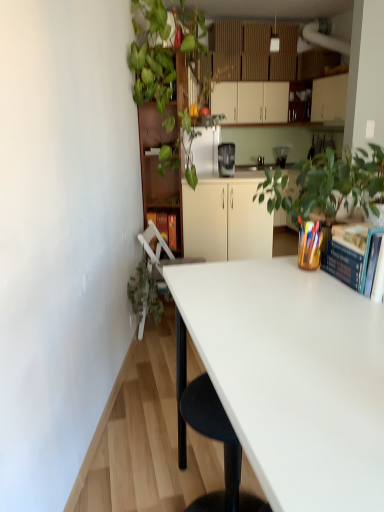
Question: Is matte black coffee maker at center looking in the opposite direction of satin black coffee maker at center?

Choices:
 (A) no
 (B) yes

Answer: (A)

Question: From the image's perspective, is matte black coffee maker at center located above satin black coffee maker at center?

Choices:
 (A) yes
 (B) no

Answer: (A)

Question: Would you say matte black coffee maker at center contains satin black coffee maker at center?

Choices:
 (A) yes
 (B) no

Answer: (B)

Question: From a real-world perspective, is matte black coffee maker at center positioned under satin black coffee maker at center based on gravity?

Choices:
 (A) no
 (B) yes

Answer: (B)

Question: Is matte black coffee maker at center outside satin black coffee maker at center?

Choices:
 (A) yes
 (B) no

Answer: (A)

Question: Considering their positions, is matte black coffee maker at center located in front of or behind blue hardcover book at upper right?

Choices:
 (A) front
 (B) behind

Answer: (B)

Question: From a real-world perspective, is matte black coffee maker at center above or below blue hardcover book at upper right?

Choices:
 (A) above
 (B) below

Answer: (A)

Question: Looking at their shapes, would you say matte black coffee maker at center is wider or thinner than blue hardcover book at upper right?

Choices:
 (A) thin
 (B) wide

Answer: (B)

Question: Would you say matte black coffee maker at center is to the left or to the right of blue hardcover book at upper right in the picture?

Choices:
 (A) left
 (B) right

Answer: (B)

Question: Does point (278, 146) appear closer or farther from the camera than point (264, 398)?

Choices:
 (A) closer
 (B) farther

Answer: (B)

Question: Is matte black coffee maker at center taller or shorter than white glossy desk at center?

Choices:
 (A) tall
 (B) short

Answer: (B)

Question: From a real-world perspective, is matte black coffee maker at center positioned above or below white glossy desk at center?

Choices:
 (A) below
 (B) above

Answer: (B)

Question: Would you say matte black coffee maker at center is inside or outside white glossy desk at center?

Choices:
 (A) inside
 (B) outside

Answer: (B)

Question: From their relative heights in the image, would you say white glossy desk at center is taller or shorter than satin black coffee maker at center?

Choices:
 (A) short
 (B) tall

Answer: (B)

Question: In the image, is white glossy desk at center positioned in front of or behind satin black coffee maker at center?

Choices:
 (A) behind
 (B) front

Answer: (B)